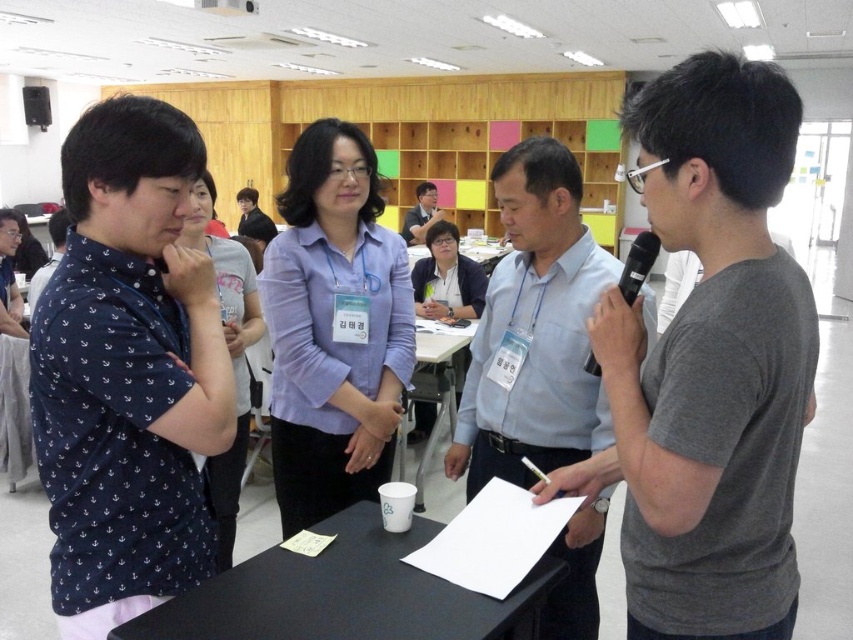
Can you confirm if dark blue printed shirt at left is wider than black matte table at center?

Incorrect, dark blue printed shirt at left's width does not surpass black matte table at center's.

Consider the image. Which is above, dark blue printed shirt at left or black matte table at center?

dark blue printed shirt at left is higher up.

Describe the element at coordinates (128, 371) in the screenshot. I see `dark blue printed shirt at left` at that location.

You are a GUI agent. You are given a task and a screenshot of the screen. Output one action in this format:
    pyautogui.click(x=<x>, y=<y>)
    Task: Click on the dark blue printed shirt at left
    The image size is (853, 640).
    Given the screenshot: What is the action you would take?
    pyautogui.click(x=128, y=371)

Which is in front, point (149, 202) or point (640, 241)?

Point (149, 202)

Who is positioned more to the left, dark blue printed shirt at left or black plastic microphone at right?

Positioned to the left is dark blue printed shirt at left.

Between point (204, 451) and point (590, 358), which one is positioned behind?

Positioned behind is point (590, 358).

Where is `dark blue printed shirt at left`? dark blue printed shirt at left is located at coordinates (128, 371).

Can you confirm if black matte table at center is shorter than white paper at center?

Indeed, black matte table at center has a lesser height compared to white paper at center.

Does black matte table at center appear on the right side of white paper at center?

No, black matte table at center is not to the right of white paper at center.

Does point (360, 536) come farther from viewer compared to point (491, 253)?

No, it is in front of (491, 253).

Locate an element on the screen. The width and height of the screenshot is (853, 640). black matte table at center is located at coordinates (346, 593).